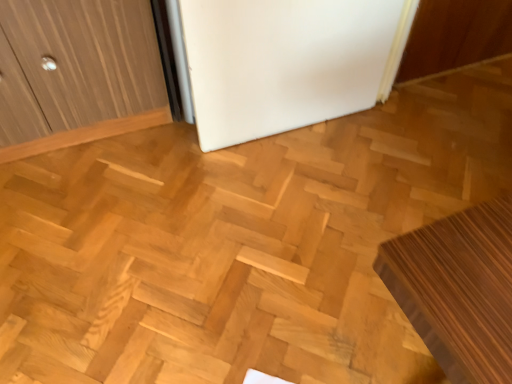
Where is `vacant space that's between wooden bench at lower right and white matte refrigerator at center`? vacant space that's between wooden bench at lower right and white matte refrigerator at center is located at coordinates (332, 204).